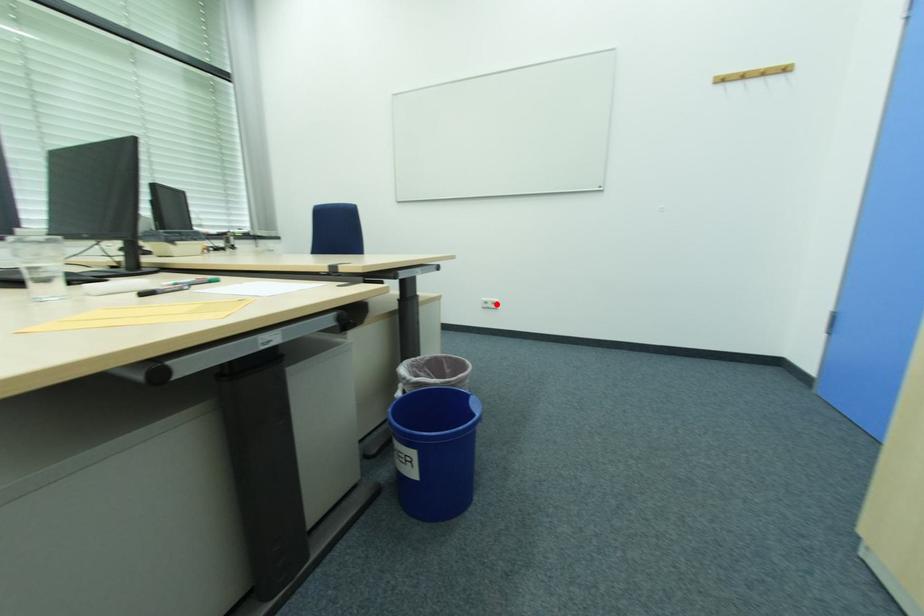
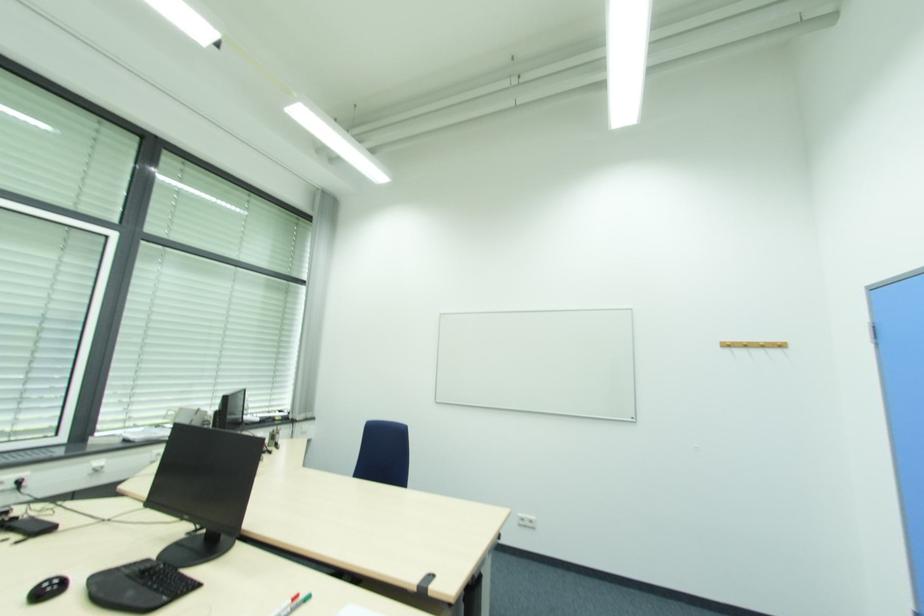
In the second image, find the point that corresponds to the highlighted location in the first image.

(533, 524)